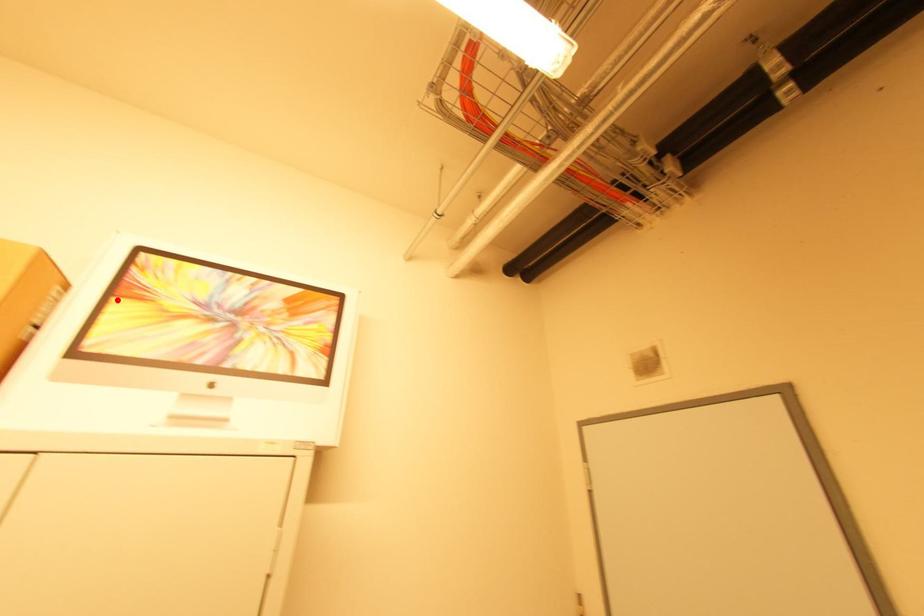
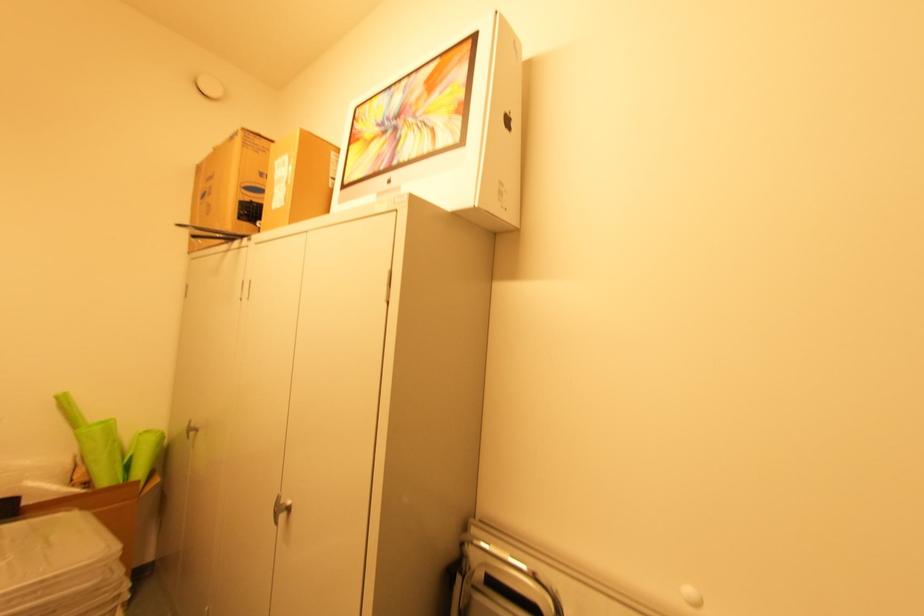
The point at the highlighted location is marked in the first image. Where is the corresponding point in the second image?

(353, 148)